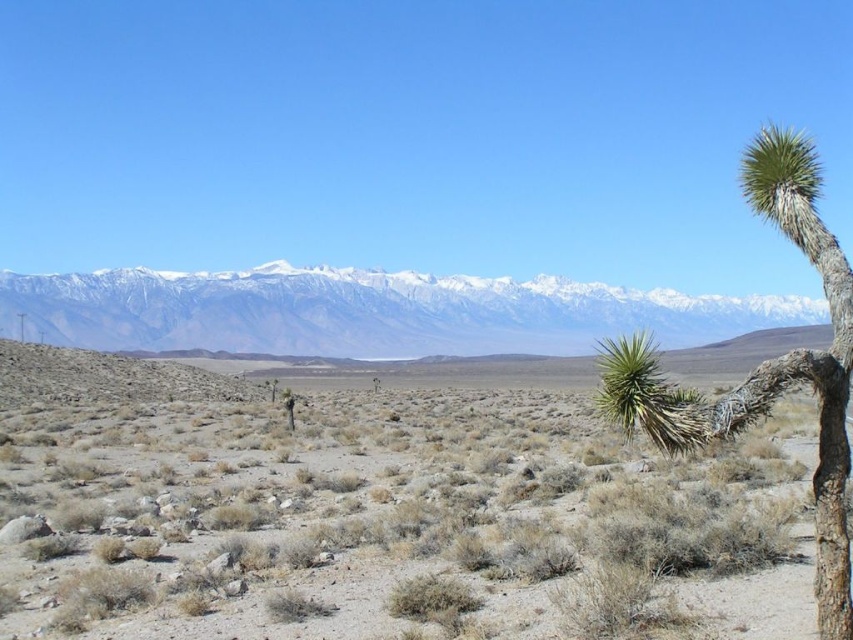
Question: Can you confirm if brown dry grass at center is wider than snowy white mountain range at upper center?

Choices:
 (A) no
 (B) yes

Answer: (A)

Question: Among these objects, which one is farthest from the camera?

Choices:
 (A) green spiky tree at right
 (B) snowy white mountain range at upper center

Answer: (B)

Question: Which point is closer to the camera?

Choices:
 (A) (849, 314)
 (B) (111, 332)

Answer: (A)

Question: From the image, what is the correct spatial relationship of brown dry grass at center in relation to snowy white mountain range at upper center?

Choices:
 (A) right
 (B) left

Answer: (B)

Question: Does brown dry grass at center have a lesser width compared to snowy white mountain range at upper center?

Choices:
 (A) no
 (B) yes

Answer: (B)

Question: Which object appears farthest from the camera in this image?

Choices:
 (A) brown dry grass at center
 (B) green spiky tree at right

Answer: (A)